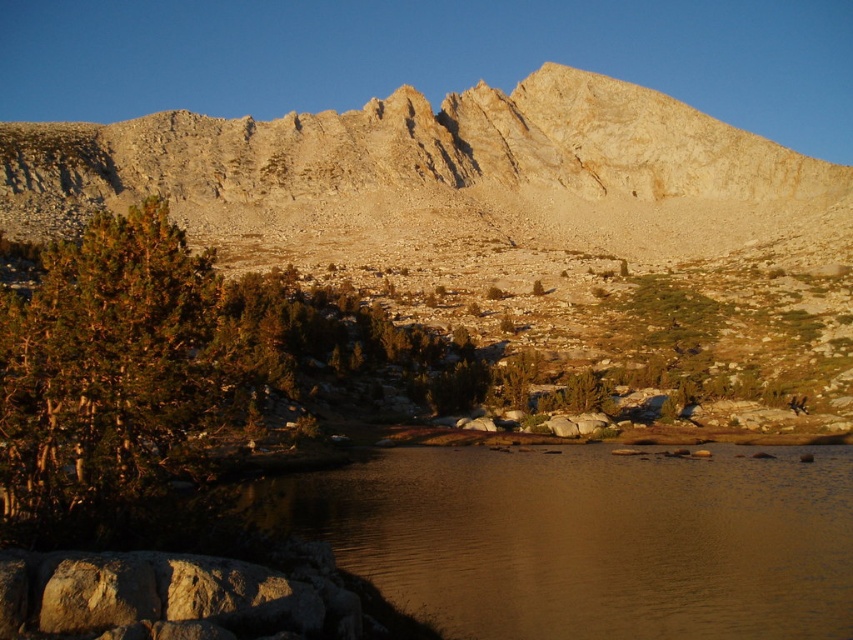
Describe the element at coordinates (450, 184) in the screenshot. I see `green shrubbery at lower left` at that location.

Between green shrubbery at lower left and brown water at center, which one appears on the left side from the viewer's perspective?

Positioned to the left is brown water at center.

Who is more distant from viewer, (368,269) or (769,595)?

The point (368,269) is behind.

Where is `green shrubbery at lower left`? This screenshot has width=853, height=640. green shrubbery at lower left is located at coordinates (450, 184).

Is green shrubbery at lower left smaller than smooth gray rock at center?

Incorrect, green shrubbery at lower left is not smaller in size than smooth gray rock at center.

Is green shrubbery at lower left taller than smooth gray rock at center?

Yes, green shrubbery at lower left is taller than smooth gray rock at center.

Does point (664, 124) lie in front of point (572, 428)?

No.

You are a GUI agent. You are given a task and a screenshot of the screen. Output one action in this format:
    pyautogui.click(x=<x>, y=<y>)
    Task: Click on the green shrubbery at lower left
    
    Given the screenshot: What is the action you would take?
    pyautogui.click(x=450, y=184)

Between brown water at center and smooth gray rock at center, which one is positioned lower?

brown water at center is below.

Looking at this image, who is more distant from viewer, (683, 609) or (556, 422)?

Point (556, 422)

Between point (689, 573) and point (579, 426), which one is positioned in front?

Positioned in front is point (689, 573).

Locate an element on the screen. The width and height of the screenshot is (853, 640). brown water at center is located at coordinates (589, 540).